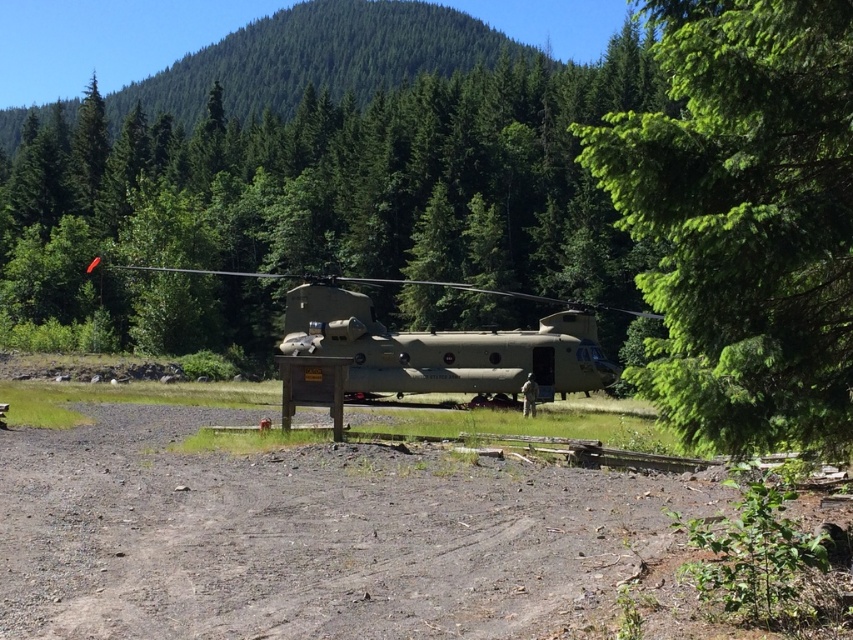
Between point (735, 61) and point (289, 317), which one is positioned behind?

Point (289, 317)

Does green leafy tree at center have a greater width compared to matte green helicopter at center?

No, green leafy tree at center is not wider than matte green helicopter at center.

At what (x,y) coordinates should I click in order to perform the action: click on green leafy tree at center. Please return your answer as a coordinate pair (x, y). This screenshot has width=853, height=640. Looking at the image, I should click on (743, 220).

Identify the location of dull brown dirt at center. The height and width of the screenshot is (640, 853). (317, 536).

Is point (223, 557) farther from camera compared to point (808, 214)?

That is True.

Does point (660, 480) come behind point (834, 339)?

Yes, point (660, 480) is behind point (834, 339).

Image resolution: width=853 pixels, height=640 pixels. I want to click on dull brown dirt at center, so click(x=317, y=536).

Which is more to the right, dull brown dirt at center or matte green helicopter at center?

matte green helicopter at center is more to the right.

Between point (222, 548) and point (500, 353), which one is positioned in front?

Point (222, 548)

Is point (78, 515) less distant than point (360, 387)?

Yes, point (78, 515) is closer to viewer.

Locate an element on the screen. This screenshot has width=853, height=640. dull brown dirt at center is located at coordinates (317, 536).